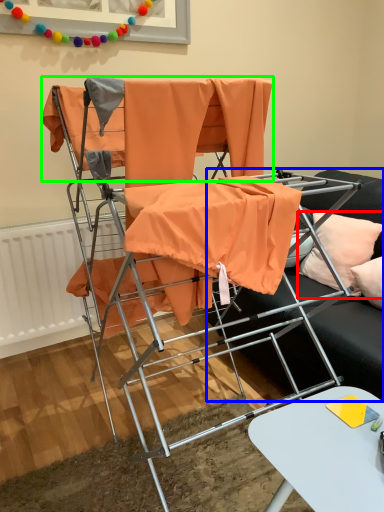
Question: Based on their relative distances, which object is nearer to pillow (highlighted by a red box)? Choose from studio couch (highlighted by a blue box) and fabric (highlighted by a green box).

Choices:
 (A) studio couch
 (B) fabric

Answer: (A)